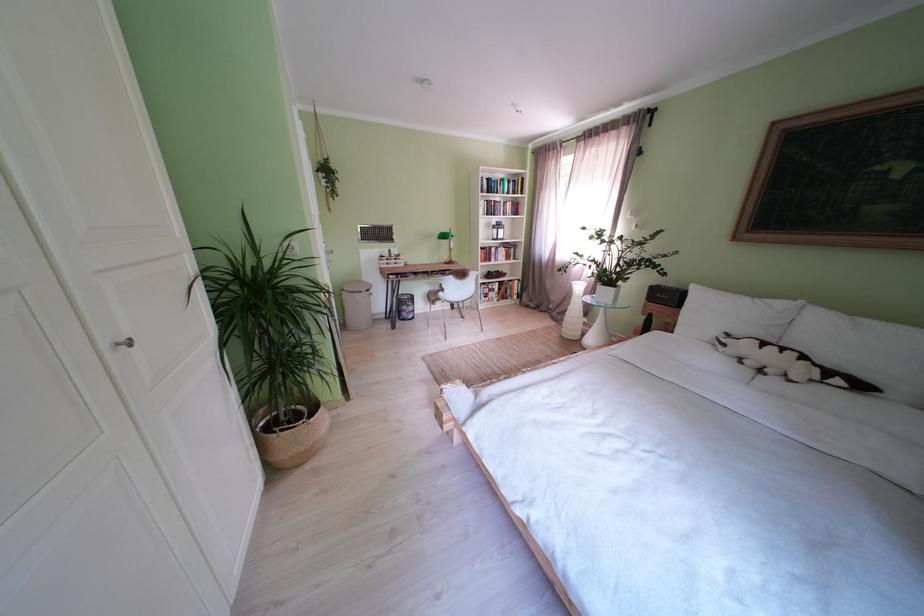
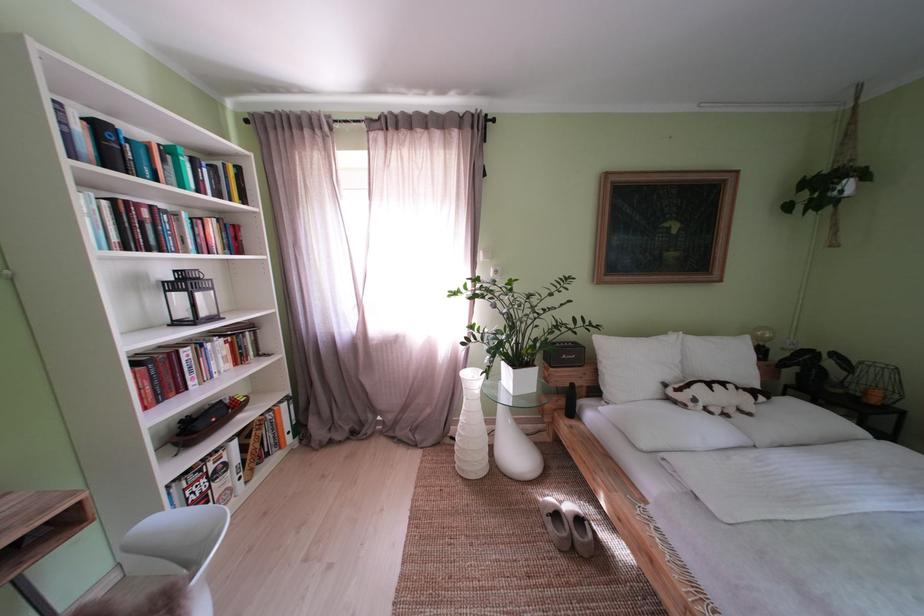
Locate, in the second image, the point that corresponds to the point at 505,254 in the first image.

(199, 359)